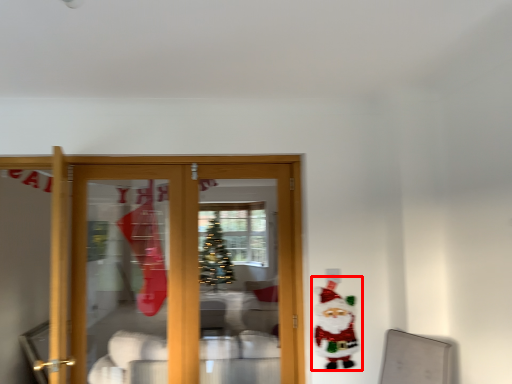
Question: From the image's perspective, what is the correct spatial relationship of santa claus (annotated by the red box) in relation to furniture?

Choices:
 (A) above
 (B) below

Answer: (A)